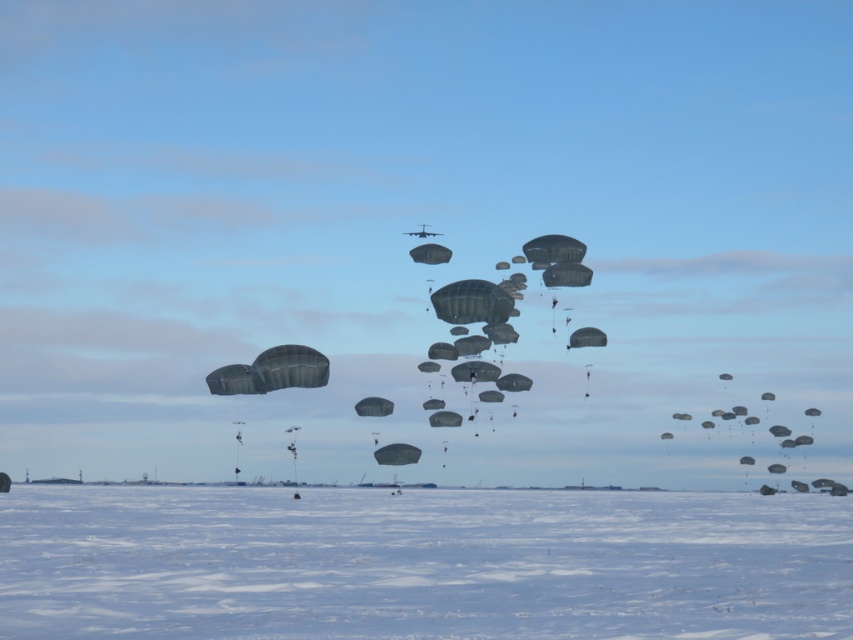
Question: Does white matte snow at lower center appear on the right side of dark gray matte parachute at center?

Choices:
 (A) yes
 (B) no

Answer: (A)

Question: Among these objects, which one is farthest from the camera?

Choices:
 (A) white matte snow at lower center
 (B) dark gray matte parachute at center
 (C) matte gray parachute at center

Answer: (C)

Question: In this image, where is white matte snow at lower center located relative to dark gray matte parachute at center?

Choices:
 (A) above
 (B) below

Answer: (B)

Question: Which point is closer to the camera taking this photo?

Choices:
 (A) (288, 344)
 (B) (402, 461)
 (C) (306, 525)

Answer: (C)

Question: Is dark gray matte parachute at center positioned in front of matte gray parachute at center?

Choices:
 (A) yes
 (B) no

Answer: (A)

Question: Estimate the real-world distances between objects in this image. Which object is closer to the matte gray parachute at center?

Choices:
 (A) white matte snow at lower center
 (B) dark gray matte parachute at center

Answer: (A)